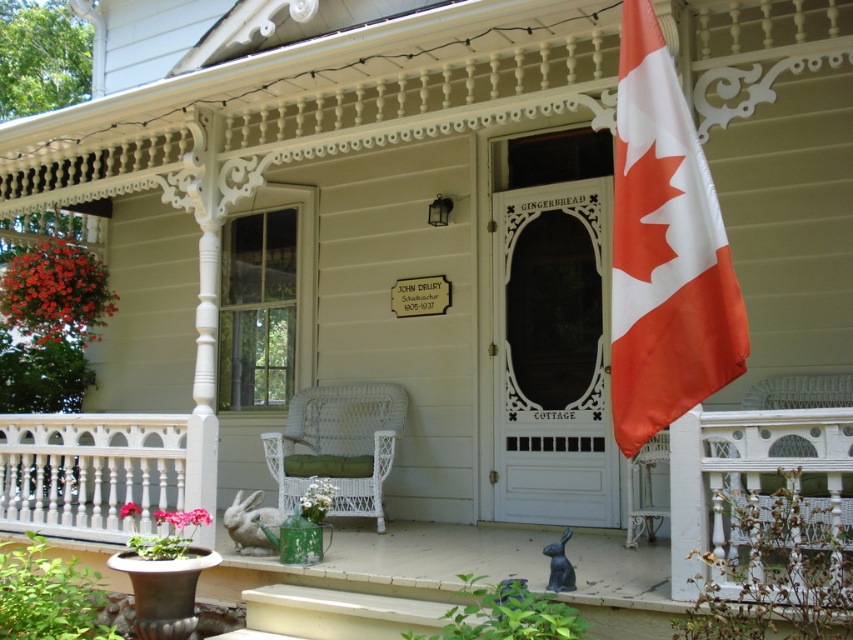
Question: Does white wicker chair at center have a greater width compared to red fabric flag at right?

Choices:
 (A) yes
 (B) no

Answer: (A)

Question: Observing the image, what is the correct spatial positioning of white wicker chair at center in reference to red fabric flag at right?

Choices:
 (A) left
 (B) right

Answer: (A)

Question: Which point is closer to the camera?

Choices:
 (A) red fabric flag at right
 (B) white wicker rocking chair at center

Answer: (A)

Question: Which point is farther from the camera taking this photo?

Choices:
 (A) (421, 548)
 (B) (621, 381)
 (C) (184, 449)
 (D) (392, 445)

Answer: (D)

Question: Can you confirm if red fabric flag at right is wider than white wicker rocking chair at center?

Choices:
 (A) no
 (B) yes

Answer: (A)

Question: Which point is closer to the camera?

Choices:
 (A) [97, 436]
 (B) [622, 317]

Answer: (B)